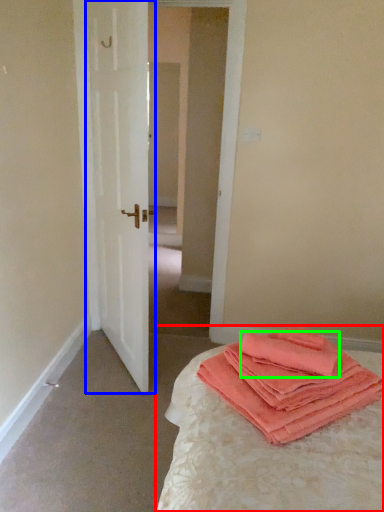
Question: Which is nearer to the bed (highlighted by a red box)? door (highlighted by a blue box) or cloth (highlighted by a green box).

Choices:
 (A) door
 (B) cloth

Answer: (B)